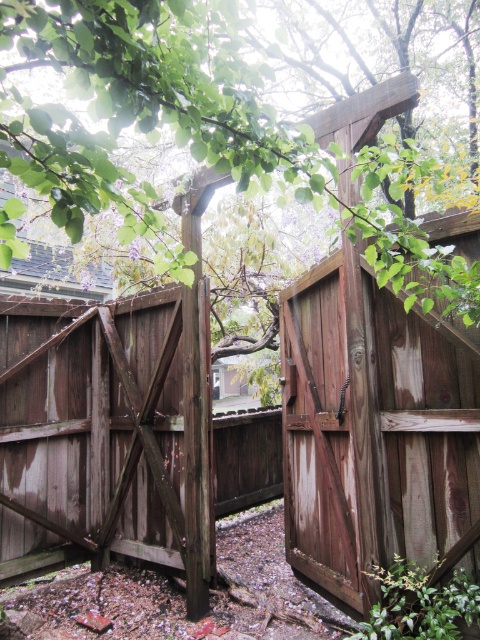
You are standing in front of the wooden fence with the ajar gate. There are two points marked on the ground near the fence. One is at coordinates point (38,42) and the other at point (137,340). Which point is closer to you?

Point (38,42) is closer to the viewer than point (137,340).